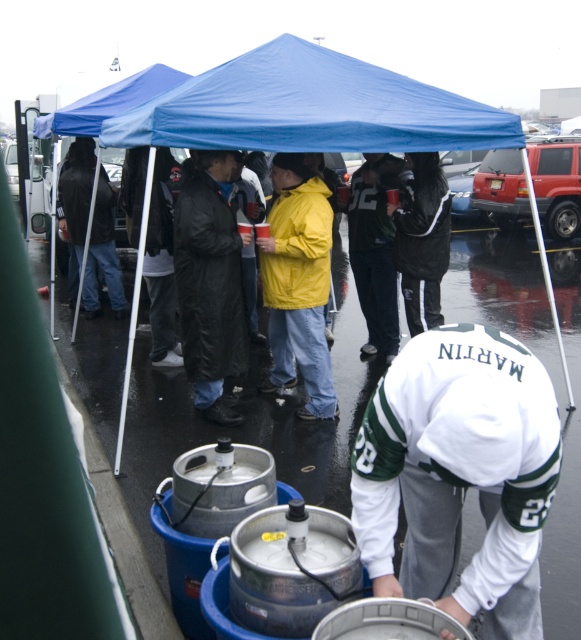
You are standing at the entrance of the tent and want to reach the keg closest to the point marked at coordinates [360,236]. How far will you have to walk from your current position?

The point marked at coordinates [360,236] is 5.93 meters away from the viewer, so you would need to walk approximately 5.93 meters to reach the keg closest to that point.

You are a photographer at the event and need to capture a clear shot of both the white jersey at lower center and the black leather coat at center. Which object should you focus on first if you want to ensure both are in focus without adjusting the camera settings?

You should focus on the white jersey at lower center first because it is larger in size compared to the black leather coat at center, allowing for a greater depth of field when capturing both objects.

Based on the scene description, where is the matte black jacket at center located in terms of coordinates?

The matte black jacket at center is located at coordinates point (374, 250).